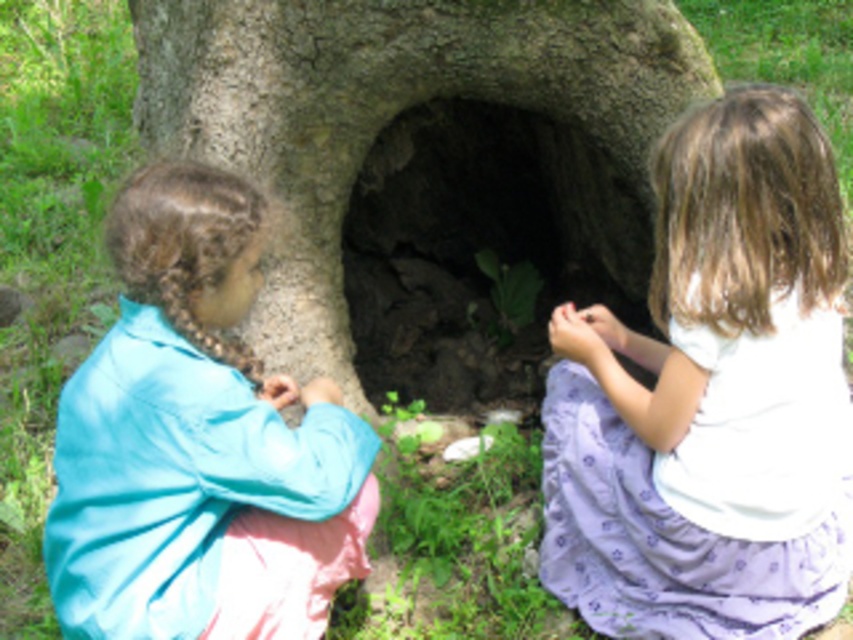
You are a photographer trying to capture both the white cotton shirt at center and the blue fabric shirt at left in a single frame. Given their widths, which shirt will appear wider in the photo?

The white cotton shirt at center will appear wider in the photo because its width surpasses that of the blue fabric shirt at left.

You are a photographer trying to capture the two points in the image. Which point, point (805, 433) or point (566, 280), is closer to your camera lens?

Point (805, 433) is closer to the camera lens than point (566, 280).